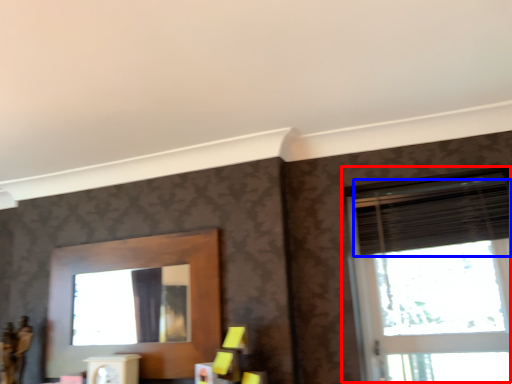
Question: Which of the following is the farthest to the observer, window (highlighted by a red box) or blind (highlighted by a blue box)?

Choices:
 (A) window
 (B) blind

Answer: (B)